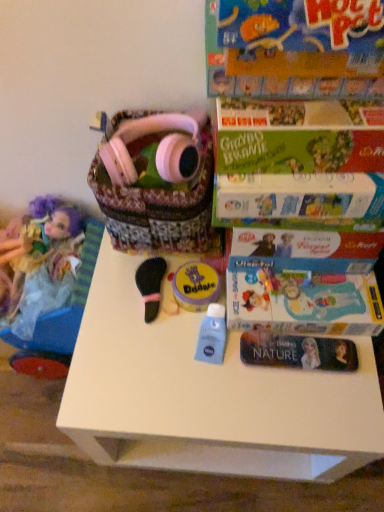
Where is `free spot above white plastic table at center (from a real-world perspective)`? free spot above white plastic table at center (from a real-world perspective) is located at coordinates (212, 347).